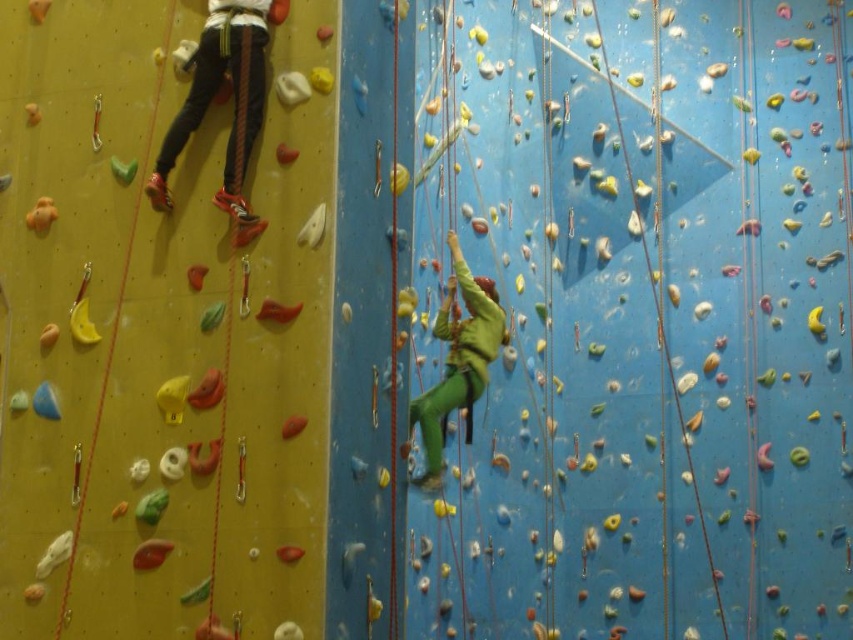
You are a photographer standing at the camera position. You want to take a clear photo of the matte black pants at left. However, the lighting in the room is poor. What adjustment should you make to your camera to ensure the pants are visible?

Since the matte black pants at left is 23.34 meters from the camera, you should increase the exposure time to allow more light to reach the sensor, ensuring the pants are visible despite the poor lighting.

You are standing at the entrance of the climbing facility and see the matte black pants at left. Based on their position, can you estimate their location in the image using coordinates?

The matte black pants at left are located at coordinates point (212, 97).